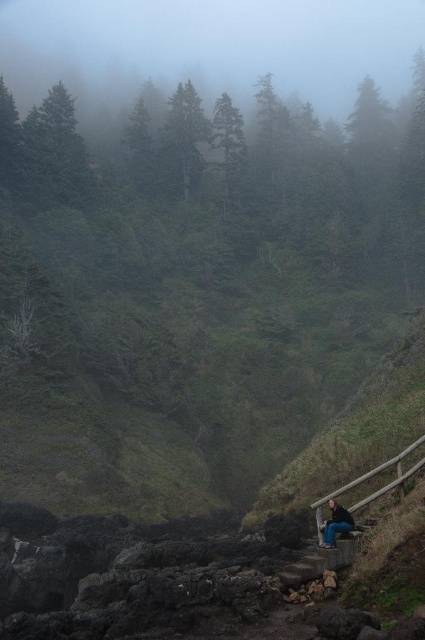
You are standing at the base of the stone steps leading up to the wooden railing in the misty forest scene. You notice a specific point marked at coordinates (206, 49). Based on the scene description, can you determine what feature this point is likely pointing to?

The point at coordinates (206, 49) corresponds to the foggy translucent forest at upper center.

Consider the image. Based on the scene description, where is the foggy translucent forest at upper center located in the image?

The foggy translucent forest at upper center is located at point (206,49).

You are a hiker trying to navigate through the misty landscape. You see the foggy translucent forest at upper center and the green matte tree at upper left. Which object is located higher up in the image?

The foggy translucent forest at upper center is positioned over the green matte tree at upper left, so it is higher up in the image.